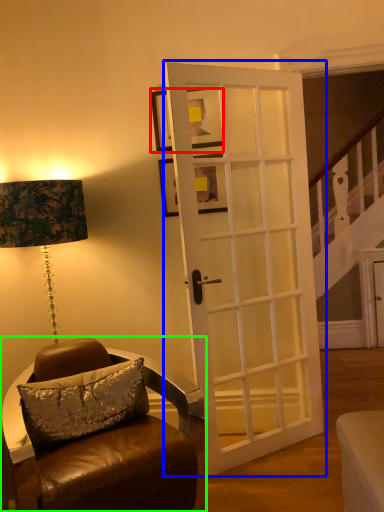
Question: Considering the real-world distances, which object is closest to picture frame (highlighted by a red box)? door (highlighted by a blue box) or chair (highlighted by a green box).

Choices:
 (A) door
 (B) chair

Answer: (A)